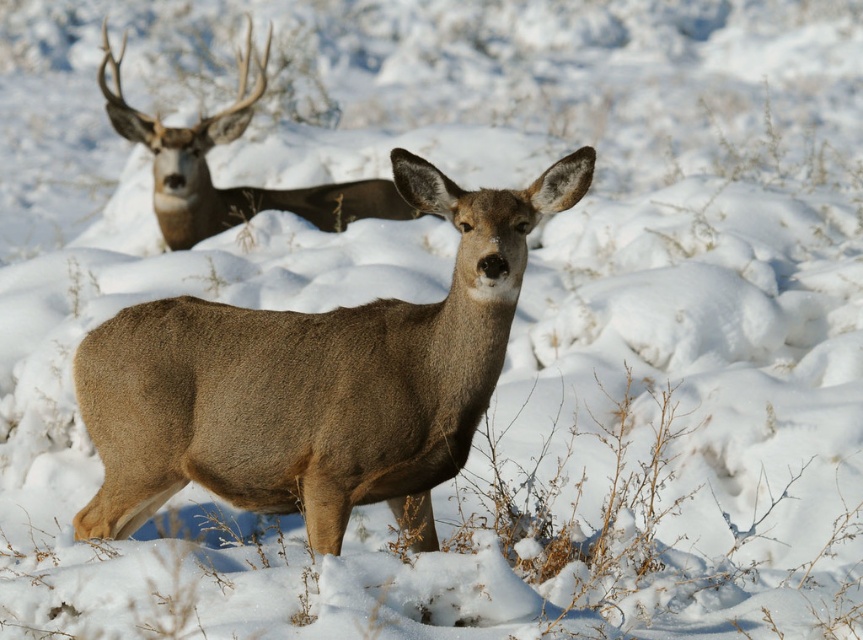
You are a wildlife photographer observing the winter scene. You want to capture a photo where the brown fur deer at center is positioned to the left of the brown velvet antlers at upper left. Based on the current arrangement, is this possible?

The brown fur deer at center is currently to the right of the brown velvet antlers at upper left, so you cannot position the brown fur deer at center to the left of the brown velvet antlers at upper left without moving either object.

You are an animal researcher observing the two deer in the snowy landscape. You notice the brown fur deer at center and the brown velvet antlers at upper left. Which deer is smaller in size?

The brown fur deer at center is smaller in size compared to the brown velvet antlers at upper left.